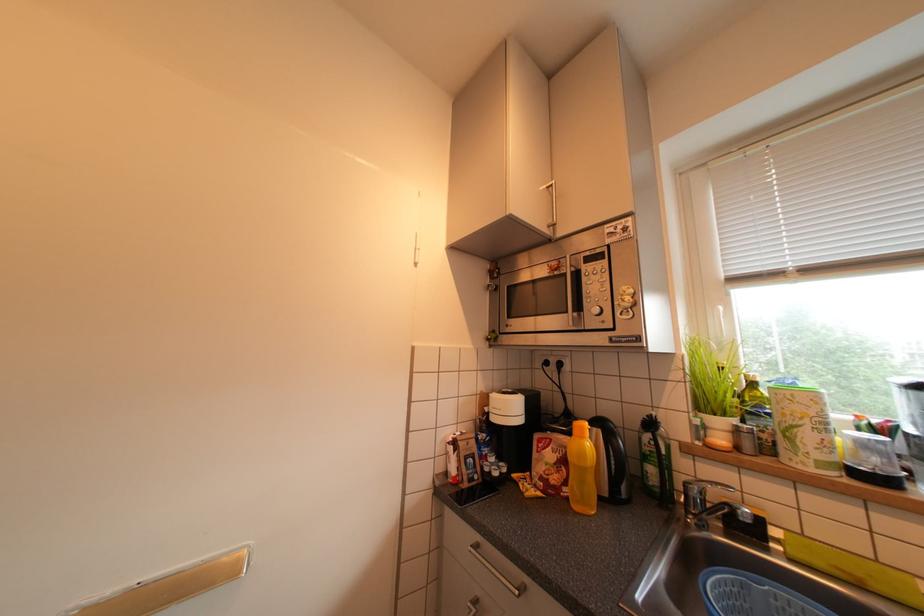
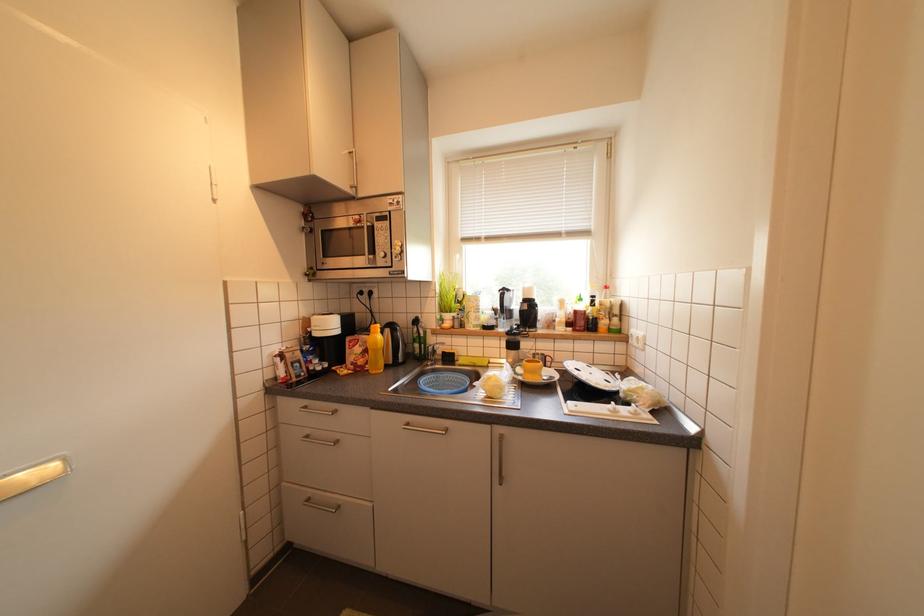
Question: The camera is either moving clockwise (left) or counter-clockwise (right) around the object. The first image is from the beginning of the video and the second image is from the end. Is the camera moving left or right when shooting the video?

Choices:
 (A) Left
 (B) Right

Answer: (A)